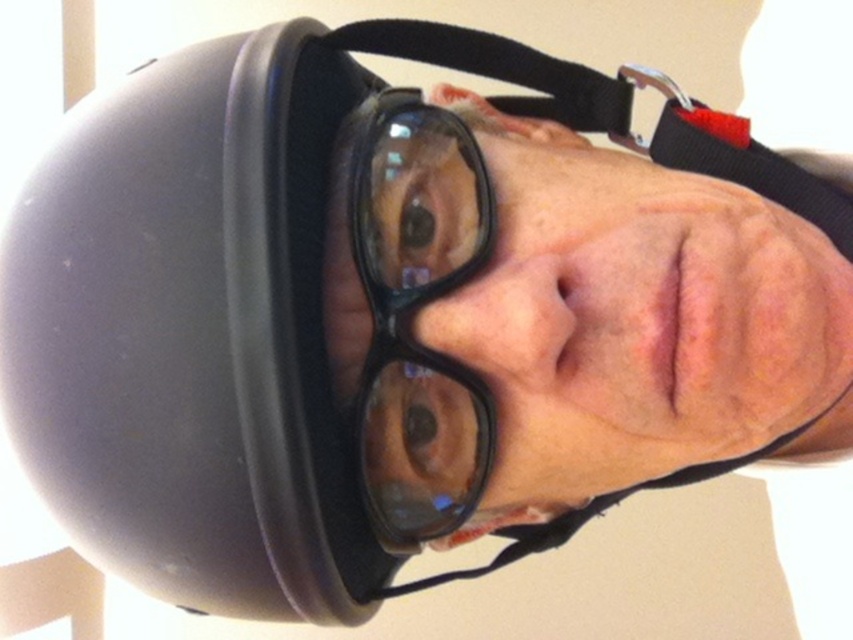
Looking at this image, you are a photographer adjusting the lighting for a product shoot. You notice a point at coordinates point [413,314] in the image. Based on the scene description, what object is located at that point?

The point [413,314] corresponds to the black plastic glasses at center.

You are standing in front of a person wearing a black helmet and black plastic glasses at center. The helmet has a shiny metallic buckle on its chin strap. If you want to hand them a tool that requires them to see clearly through their glasses, should you approach closer or stay at your current distance?

The black plastic glasses at center is 46.19 centimeters away from viewer, so you should approach closer to ensure they can see the tool clearly through their glasses.

From the picture: You are a delivery robot with a height of 18 inches. You need to pass through a doorway that is 20 inches tall. There are two objects in your path. The first is a black helmet with a chin strap at point (376,296). The second is large black framed glasses at point 0.536, 0.558. Which object is closer to the doorway entrance so you can navigate around it first?

The black helmet with a chin strap at point (376,296) is closer to the doorway entrance than the large black framed glasses at point 0.536, 0.558. Since they are 18.49 inches apart, the robot can navigate around the closer object first to ensure clearance under the 20 inch doorway.